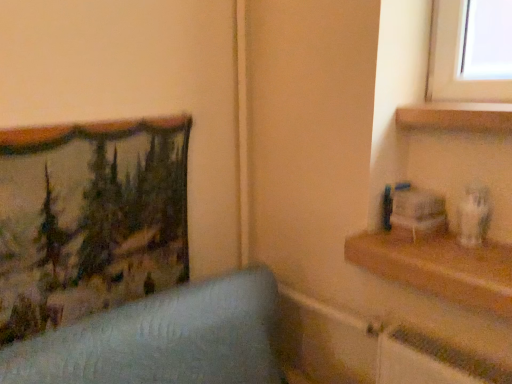
Question: Looking at their shapes, would you say wooden shelf at upper right, arranged as the first shelf when viewed from the top, is wider or thinner than textured fabric picture frame at left?

Choices:
 (A) wide
 (B) thin

Answer: (A)

Question: Based on their positions, is wooden shelf at upper right, arranged as the first shelf when viewed from the top, located to the left or right of textured fabric picture frame at left?

Choices:
 (A) left
 (B) right

Answer: (B)

Question: Estimate the real-world distances between objects in this image. Which object is closer to the wooden shelf at upper right, the 2th shelf when ordered from bottom to top?

Choices:
 (A) textured fabric picture frame at left
 (B) wooden shelf at right, the second shelf when ordered from top to bottom

Answer: (B)

Question: Which is nearer to the textured fabric picture frame at left?

Choices:
 (A) wooden shelf at upper right, arranged as the first shelf when viewed from the top
 (B) wooden shelf at right, the second shelf when ordered from top to bottom

Answer: (B)